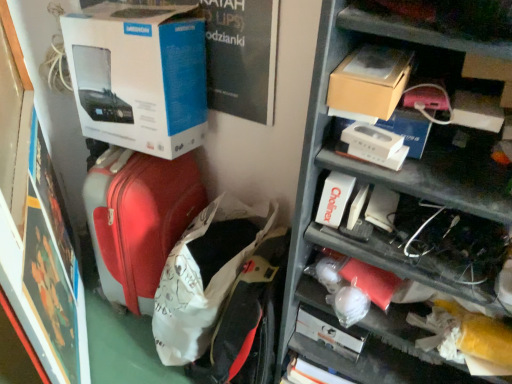
Question: Is matte red suitcase at center in contact with brown cardboard box at upper right?

Choices:
 (A) yes
 (B) no

Answer: (B)

Question: Considering the relative sizes of matte red suitcase at center and brown cardboard box at upper right in the image provided, is matte red suitcase at center thinner than brown cardboard box at upper right?

Choices:
 (A) no
 (B) yes

Answer: (A)

Question: Is the position of matte red suitcase at center more distant than that of brown cardboard box at upper right?

Choices:
 (A) no
 (B) yes

Answer: (B)

Question: Considering the relative positions of matte red suitcase at center and brown cardboard box at upper right in the image provided, is matte red suitcase at center to the right of brown cardboard box at upper right from the viewer's perspective?

Choices:
 (A) yes
 (B) no

Answer: (B)

Question: Considering the relative sizes of matte red suitcase at center and brown cardboard box at upper right in the image provided, is matte red suitcase at center taller than brown cardboard box at upper right?

Choices:
 (A) yes
 (B) no

Answer: (A)

Question: Do you think matte red suitcase at left is within brown cardboard box at upper right, or outside of it?

Choices:
 (A) outside
 (B) inside

Answer: (A)

Question: In terms of height, does matte red suitcase at left look taller or shorter compared to brown cardboard box at upper right?

Choices:
 (A) tall
 (B) short

Answer: (A)

Question: Is matte red suitcase at left to the left or to the right of brown cardboard box at upper right in the image?

Choices:
 (A) right
 (B) left

Answer: (B)

Question: In terms of size, does matte red suitcase at left appear bigger or smaller than brown cardboard box at upper right?

Choices:
 (A) big
 (B) small

Answer: (A)

Question: In terms of size, does matte red suitcase at center appear bigger or smaller than metallic gray shelves at upper right?

Choices:
 (A) big
 (B) small

Answer: (B)

Question: From their relative heights in the image, would you say matte red suitcase at center is taller or shorter than metallic gray shelves at upper right?

Choices:
 (A) short
 (B) tall

Answer: (A)

Question: From the image's perspective, is matte red suitcase at center above or below metallic gray shelves at upper right?

Choices:
 (A) below
 (B) above

Answer: (A)

Question: Would you say matte red suitcase at center is to the left or to the right of metallic gray shelves at upper right in the picture?

Choices:
 (A) right
 (B) left

Answer: (B)

Question: From the image's perspective, is white cardboard box at upper left above or below metallic gray shelves at upper right?

Choices:
 (A) above
 (B) below

Answer: (A)

Question: In terms of height, does white cardboard box at upper left look taller or shorter compared to metallic gray shelves at upper right?

Choices:
 (A) short
 (B) tall

Answer: (A)